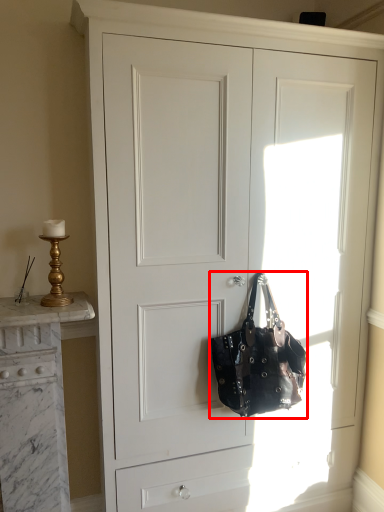
Question: From the image's perspective, what is the correct spatial relationship of handbag (annotated by the red box) in relation to table lamp?

Choices:
 (A) below
 (B) above

Answer: (A)